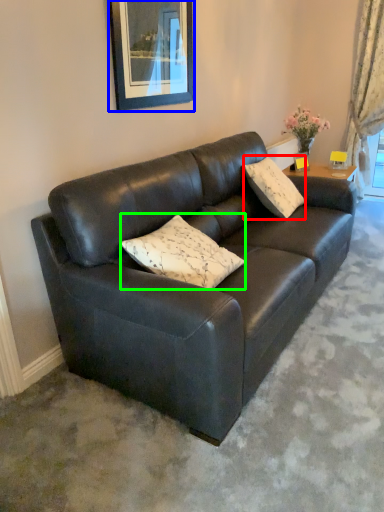
Question: Which object is the farthest from pillow (highlighted by a red box)? Choose among these: picture frame (highlighted by a blue box) or pillow (highlighted by a green box).

Choices:
 (A) picture frame
 (B) pillow

Answer: (B)